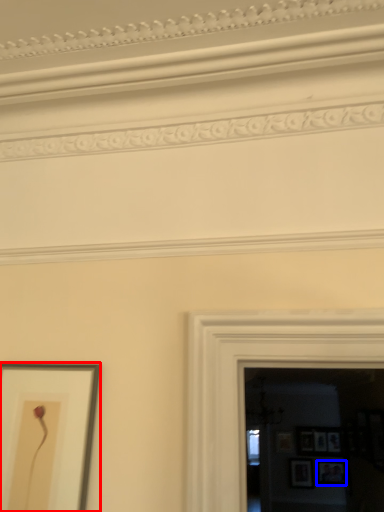
Question: Among these objects, which one is farthest to the camera, picture frame (highlighted by a red box) or picture frame (highlighted by a blue box)?

Choices:
 (A) picture frame
 (B) picture frame

Answer: (B)